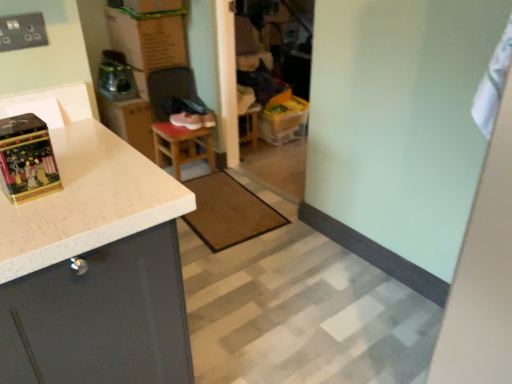
Identify the location of wooden stool at center. The width and height of the screenshot is (512, 384). (182, 146).

The height and width of the screenshot is (384, 512). I want to click on pink suede shoe at center, so click(x=186, y=120).

Is white fabric at upper right at the back of pink suede shoe at center?

No, pink suede shoe at center is not facing the opposite direction of white fabric at upper right.

Is pink suede shoe at center in contact with white fabric at upper right?

They are not placed beside each other.

Which object is more forward, pink suede shoe at center or white fabric at upper right?

Positioned in front is white fabric at upper right.

In the image, there is a pink suede shoe at center. What are the coordinates of `laundry below it (from the image's perspective)` in the screenshot? It's located at (493, 84).

Measure the distance from cardboard box at upper center to gold metallic box at left.

cardboard box at upper center is 6.51 feet away from gold metallic box at left.

Is cardboard box at upper center with gold metallic box at left?

No, cardboard box at upper center is not touching gold metallic box at left.

Which is in front, point (126, 8) or point (13, 179)?

Positioned in front is point (13, 179).

Visually, is cardboard box at upper center positioned to the left or to the right of gold metallic box at left?

Based on their positions, cardboard box at upper center is located to the left of gold metallic box at left.

From the picture: From the image's perspective, which one is positioned lower, wooden stool at center or gold metallic box at left?

gold metallic box at left is shown below in the image.

Who is shorter, wooden stool at center or gold metallic box at left?

With less height is gold metallic box at left.

Does wooden stool at center turn towards gold metallic box at left?

No, wooden stool at center is not turned towards gold metallic box at left.

Looking at this image, does brown textured mat at center have a lesser height compared to gold metallic box at left?

Yes.

How distant is brown textured mat at center from gold metallic box at left?

brown textured mat at center and gold metallic box at left are 5.10 feet apart from each other.

From a real-world perspective, is brown textured mat at center positioned above or below gold metallic box at left?

From a real-world perspective, brown textured mat at center is physically below gold metallic box at left.

Identify the location of mat below the gold metallic box at left (from the image's perspective). (228, 212).

Would you say brown textured mat at center is a long distance from white fabric at upper right?

Absolutely, brown textured mat at center is distant from white fabric at upper right.

Which is closer, (243,220) or (504,85)?

The point (504,85) is in front.

At what (x,y) coordinates should I click in order to perform the action: click on cardboard box located in front of the pink suede shoe at center. Please return your answer as a coordinate pair (x, y). The width and height of the screenshot is (512, 384). Looking at the image, I should click on (149, 36).

From a real-world perspective, is pink suede shoe at center below cardboard box at upper center?

Yes, from a real-world perspective, pink suede shoe at center is beneath cardboard box at upper center.

Considering the relative sizes of pink suede shoe at center and cardboard box at upper center in the image provided, is pink suede shoe at center shorter than cardboard box at upper center?

Correct, pink suede shoe at center is not as tall as cardboard box at upper center.

Does pink suede shoe at center turn towards cardboard box at upper center?

No, pink suede shoe at center is not aimed at cardboard box at upper center.

Does wooden stool at center appear on the right side of white fabric at upper right?

Incorrect, wooden stool at center is not on the right side of white fabric at upper right.

Relative to white fabric at upper right, is wooden stool at center in front or behind?

wooden stool at center is behind white fabric at upper right.

From the image's perspective, does wooden stool at center appear lower than white fabric at upper right?

Incorrect, from the image's perspective, wooden stool at center is higher than white fabric at upper right.

Based on the photo, can you see wooden stool at center touching white fabric at upper right?

wooden stool at center is not next to white fabric at upper right, and they're not touching.

Image resolution: width=512 pixels, height=384 pixels. I want to click on laundry above the pink suede shoe at center (from a real-world perspective), so 493,84.

The image size is (512, 384). What are the coordinates of `box on the right of cardboard box at upper center` in the screenshot? It's located at (27, 159).

From the picture: Which object lies further to the anchor point white speckled laminate cabinet at left, gold metallic box at left or brown textured mat at center?

brown textured mat at center lies further to white speckled laminate cabinet at left than the other object.

Looking at this image, estimate the real-world distances between objects in this image. Which object is further from pink suede shoe at center, white speckled laminate cabinet at left or white fabric at upper right?

white fabric at upper right.

From the image, which object appears to be nearer to gold metallic box at left, pink suede shoe at center or brown textured mat at center?

Based on the image, brown textured mat at center appears to be nearer to gold metallic box at left.

When comparing their distances from wooden stool at center, does white fabric at upper right or cardboard box at upper center seem further?

Based on the image, white fabric at upper right appears to be further to wooden stool at center.

Looking at this image, based on their spatial positions, is brown textured mat at center or cardboard box at upper center further from wooden stool at center?

Among the two, cardboard box at upper center is located further to wooden stool at center.

Estimate the real-world distances between objects in this image. Which object is further from white speckled laminate cabinet at left, cardboard box at upper center or gold metallic box at left?

cardboard box at upper center is positioned further to the anchor white speckled laminate cabinet at left.

Considering their positions, is white fabric at upper right positioned closer to white speckled laminate cabinet at left than cardboard box at upper center?

white fabric at upper right lies closer to white speckled laminate cabinet at left than the other object.

Based on their spatial positions, is white fabric at upper right or cardboard box at upper center further from pink suede shoe at center?

The object further to pink suede shoe at center is white fabric at upper right.

At what (x,y) coordinates should I click in order to perform the action: click on footwear between cardboard box at upper center and brown textured mat at center vertically. Please return your answer as a coordinate pair (x, y). The height and width of the screenshot is (384, 512). Looking at the image, I should click on (186, 120).

This screenshot has width=512, height=384. I want to click on laundry between white speckled laminate cabinet at left and wooden stool at center in the front-back direction, so (x=493, y=84).

Locate an element on the screen. The height and width of the screenshot is (384, 512). mat positioned between white speckled laminate cabinet at left and wooden stool at center from near to far is located at coordinates (228, 212).

At what (x,y) coordinates should I click in order to perform the action: click on mat between white speckled laminate cabinet at left and pink suede shoe at center along the z-axis. Please return your answer as a coordinate pair (x, y). The image size is (512, 384). Looking at the image, I should click on tap(228, 212).